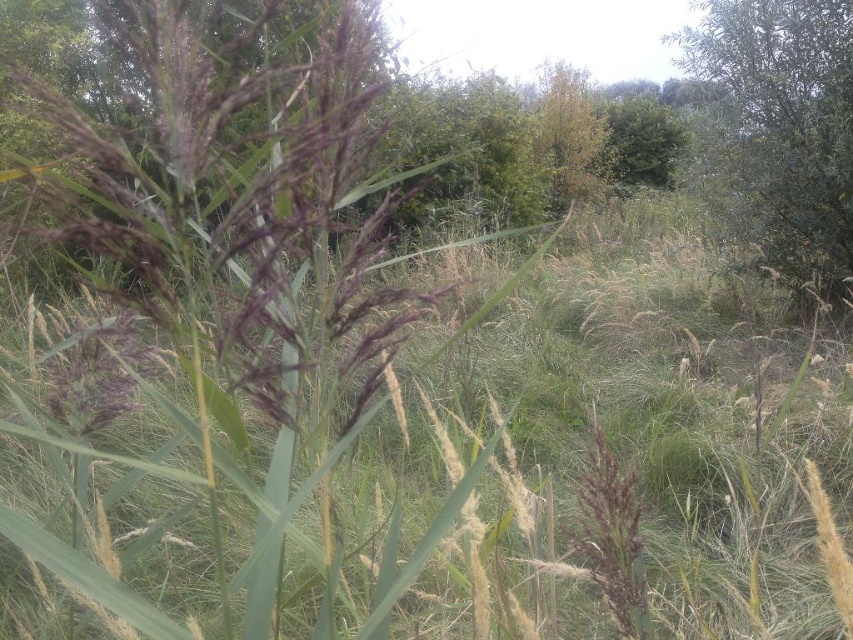
Question: Does purple matte grass at center appear under green leafy tree at upper right?

Choices:
 (A) yes
 (B) no

Answer: (A)

Question: Is purple matte grass at center wider than green leafy tree at upper right?

Choices:
 (A) no
 (B) yes

Answer: (A)

Question: Is purple matte grass at center closer to camera compared to green leafy tree at upper right?

Choices:
 (A) yes
 (B) no

Answer: (A)

Question: Among these objects, which one is nearest to the camera?

Choices:
 (A) green leafy tree at upper right
 (B) purple matte grass at center

Answer: (B)